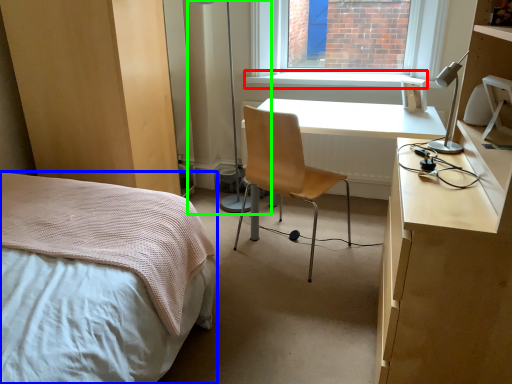
Question: Which is nearer to the window sill (highlighted by a red box)? bed (highlighted by a blue box) or table lamp (highlighted by a green box).

Choices:
 (A) bed
 (B) table lamp

Answer: (B)